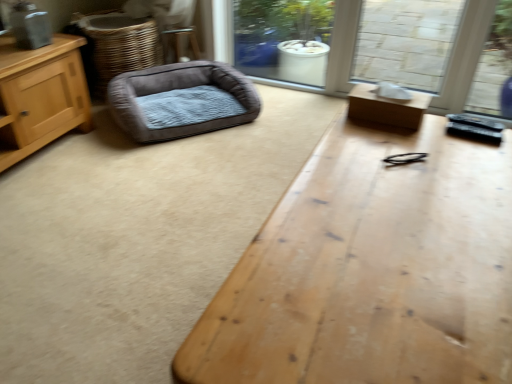
This screenshot has height=384, width=512. Find the location of `vacant position to the left of wooden table at center, which is the 2th table in top-to-bottom order`. vacant position to the left of wooden table at center, which is the 2th table in top-to-bottom order is located at coordinates (129, 264).